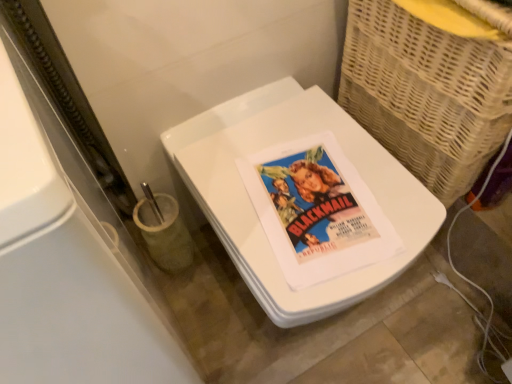
Identify the location of vacant area that is situated to the right of matte paper poster at center. The image size is (512, 384). (388, 194).